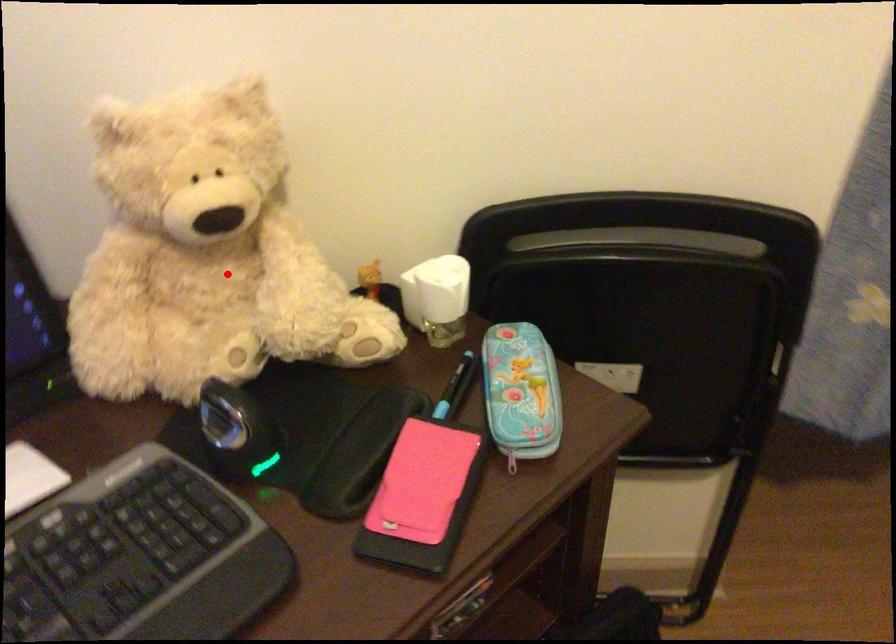
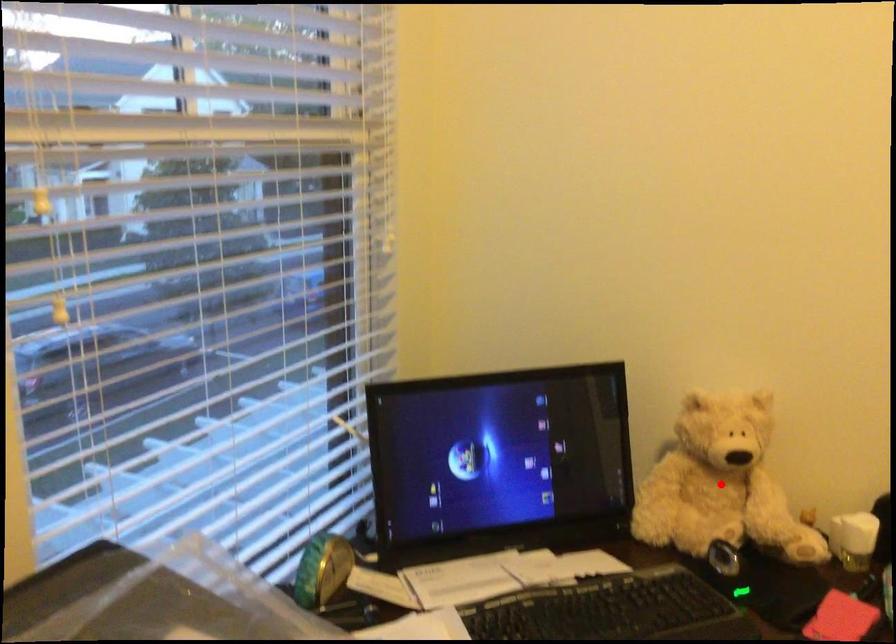
I am providing you with two images of the same scene from different viewpoints. A red point is marked on the first image and another point is marked on the second image. Is the red point in image1 aligned with the point shown in image2?

Yes